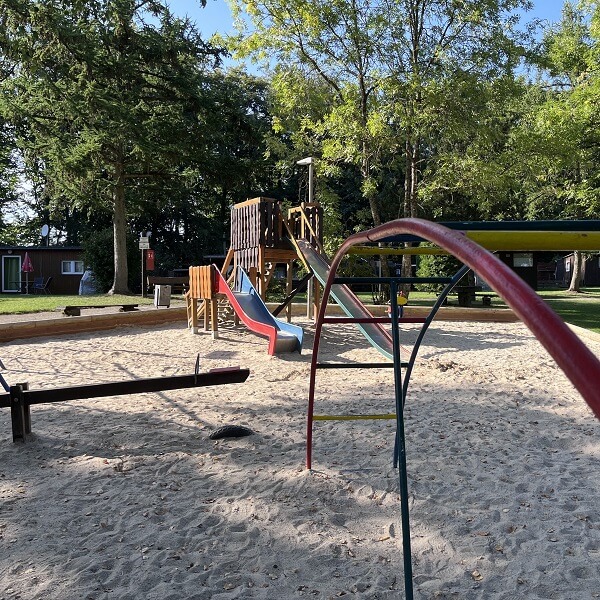
In order to click on windows in this screenshot , I will do `click(65, 270)`, `click(81, 270)`, `click(520, 263)`, `click(569, 264)`.